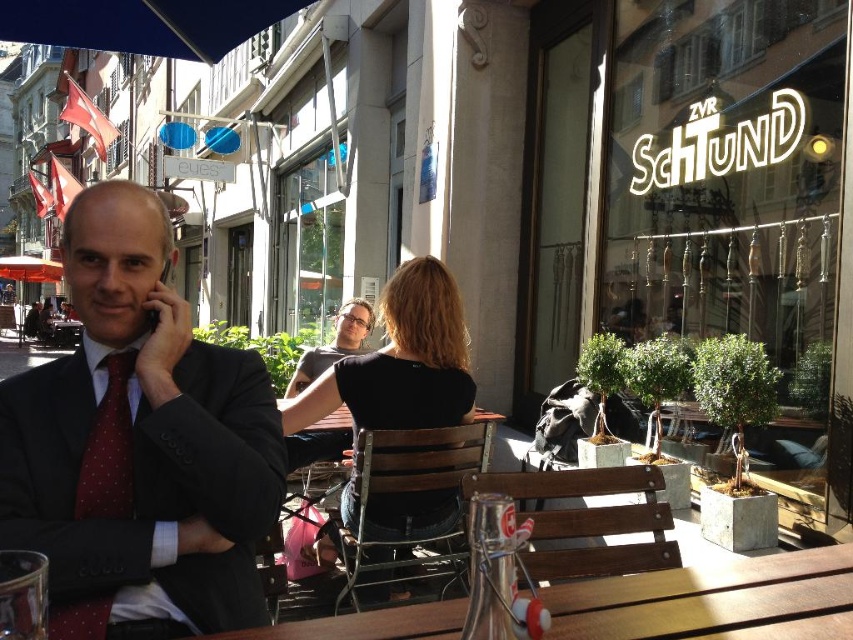
Question: Is red dotted tie at left wider than matte black shirt at center?

Choices:
 (A) yes
 (B) no

Answer: (B)

Question: Which point is closer to the camera?

Choices:
 (A) black fabric shirt at center
 (B) matte black shirt at center
 (C) red dotted tie at left
 (D) matte black suit at center

Answer: (D)

Question: Is matte black suit at center smaller than black fabric shirt at center?

Choices:
 (A) no
 (B) yes

Answer: (B)

Question: Among these objects, which one is farthest from the camera?

Choices:
 (A) red dotted tie at left
 (B) matte black suit at center
 (C) matte black shirt at center

Answer: (C)

Question: Among these objects, which one is nearest to the camera?

Choices:
 (A) red dotted tie at left
 (B) black fabric shirt at center
 (C) matte black suit at center

Answer: (C)

Question: Is matte black suit at center thinner than black fabric shirt at center?

Choices:
 (A) no
 (B) yes

Answer: (B)